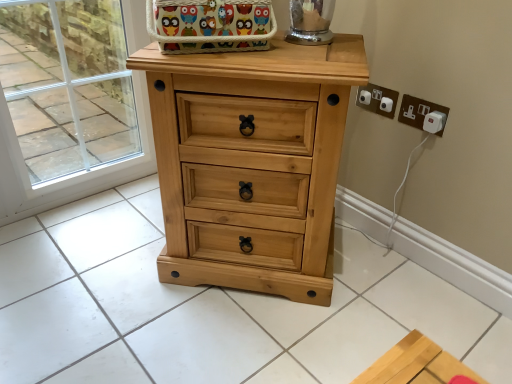
You are a GUI agent. You are given a task and a screenshot of the screen. Output one action in this format:
    pyautogui.click(x=<x>, y=<y>)
    Task: Click on the vacant area that is in front of light wood chest of drawers at center
    
    Given the screenshot: What is the action you would take?
    pyautogui.click(x=238, y=337)